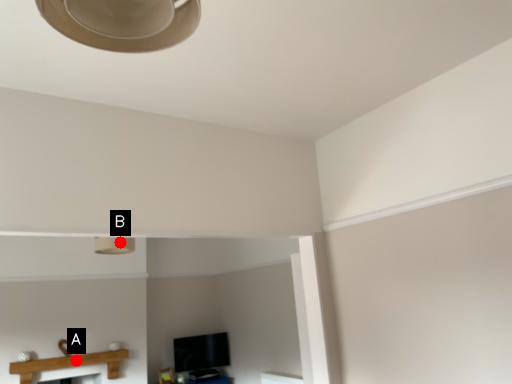
Question: Two points are circled on the image, labeled by A and B beside each circle. Which point is farther to the camera?

Choices:
 (A) A is further
 (B) B is further

Answer: (A)